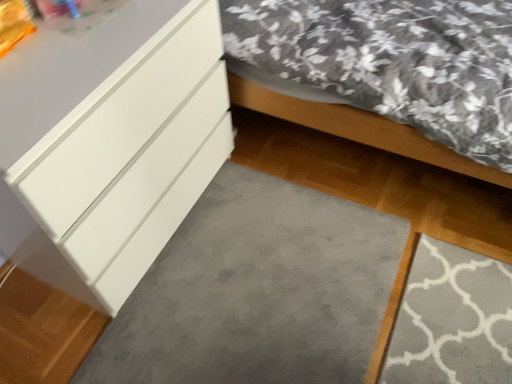
Question: Does gray soft carpet at lower center appear on the right side of white glossy chest of drawers at left?

Choices:
 (A) no
 (B) yes

Answer: (B)

Question: Is the position of gray soft carpet at lower center more distant than that of white glossy chest of drawers at left?

Choices:
 (A) no
 (B) yes

Answer: (B)

Question: Can you confirm if gray soft carpet at lower center is taller than white glossy chest of drawers at left?

Choices:
 (A) yes
 (B) no

Answer: (B)

Question: Is the depth of gray soft carpet at lower center less than that of white glossy chest of drawers at left?

Choices:
 (A) no
 (B) yes

Answer: (A)

Question: Is gray soft carpet at lower center outside white glossy chest of drawers at left?

Choices:
 (A) yes
 (B) no

Answer: (A)

Question: Is gray soft carpet at lower center to the left of white glossy chest of drawers at left from the viewer's perspective?

Choices:
 (A) yes
 (B) no

Answer: (B)

Question: Is gray soft carpet at lower center outside matte white bed at lower left?

Choices:
 (A) yes
 (B) no

Answer: (A)

Question: From a real-world perspective, is gray soft carpet at lower center beneath matte white bed at lower left?

Choices:
 (A) yes
 (B) no

Answer: (A)

Question: Can you confirm if gray soft carpet at lower center is bigger than matte white bed at lower left?

Choices:
 (A) yes
 (B) no

Answer: (B)

Question: Can matte white bed at lower left be found inside gray soft carpet at lower center?

Choices:
 (A) no
 (B) yes

Answer: (A)

Question: Considering the relative sizes of gray soft carpet at lower center and matte white bed at lower left in the image provided, is gray soft carpet at lower center thinner than matte white bed at lower left?

Choices:
 (A) yes
 (B) no

Answer: (A)

Question: Is gray soft carpet at lower center in front of matte white bed at lower left?

Choices:
 (A) no
 (B) yes

Answer: (A)

Question: Is matte white bed at lower left thinner than gray soft carpet at lower center?

Choices:
 (A) no
 (B) yes

Answer: (A)